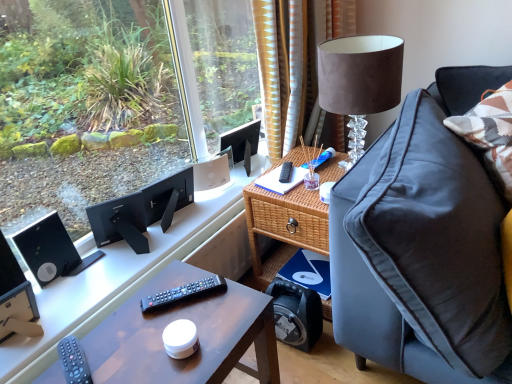
Where is `free space above woven wood side table at center (from a real-world perspective)`? The height and width of the screenshot is (384, 512). free space above woven wood side table at center (from a real-world perspective) is located at coordinates (301, 175).